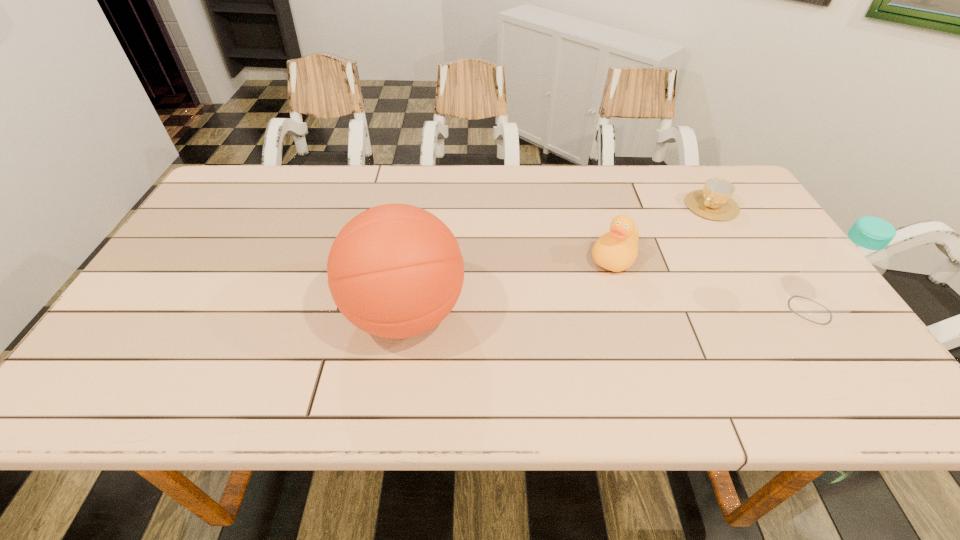
The width and height of the screenshot is (960, 540). I want to click on vacant space at the near edge of the desktop, so click(x=442, y=346).

Identify the location of vacant area at the left edge. (222, 241).

Image resolution: width=960 pixels, height=540 pixels. Identify the location of free space at the far left corner. (270, 169).

Where is `free space at the near right corner of the desktop`? The height and width of the screenshot is (540, 960). free space at the near right corner of the desktop is located at coordinates (850, 345).

I want to click on empty space that is in between the bottle and the third tallest object, so click(712, 284).

Locate an element on the screen. vacant area between the farthest object and the bottle is located at coordinates (760, 258).

You are a GUI agent. You are given a task and a screenshot of the screen. Output one action in this format:
    pyautogui.click(x=<x>, y=<y>)
    Task: Click on the free space between the bottle and the farthest object
    
    Given the screenshot: What is the action you would take?
    pyautogui.click(x=760, y=258)

Identify the location of vacant space that's between the second shortest object and the shortest object. The image size is (960, 540). (662, 231).

Locate an element on the screen. free spot between the leftmost object and the bottle is located at coordinates (608, 312).

Image resolution: width=960 pixels, height=540 pixels. Find the location of `blank region between the bottle and the farthest object`. blank region between the bottle and the farthest object is located at coordinates (760, 258).